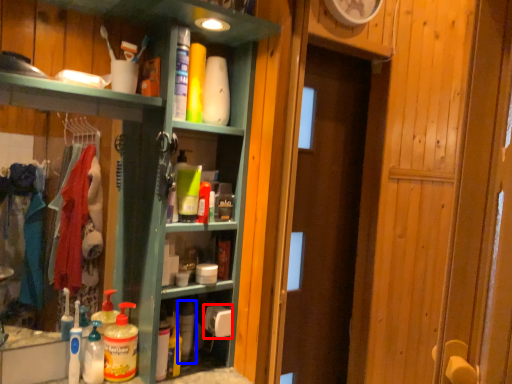
Question: Among these objects, which one is nearest to the camera, toilet paper (highlighted by a red box) or cleaning product (highlighted by a blue box)?

Choices:
 (A) toilet paper
 (B) cleaning product

Answer: (B)